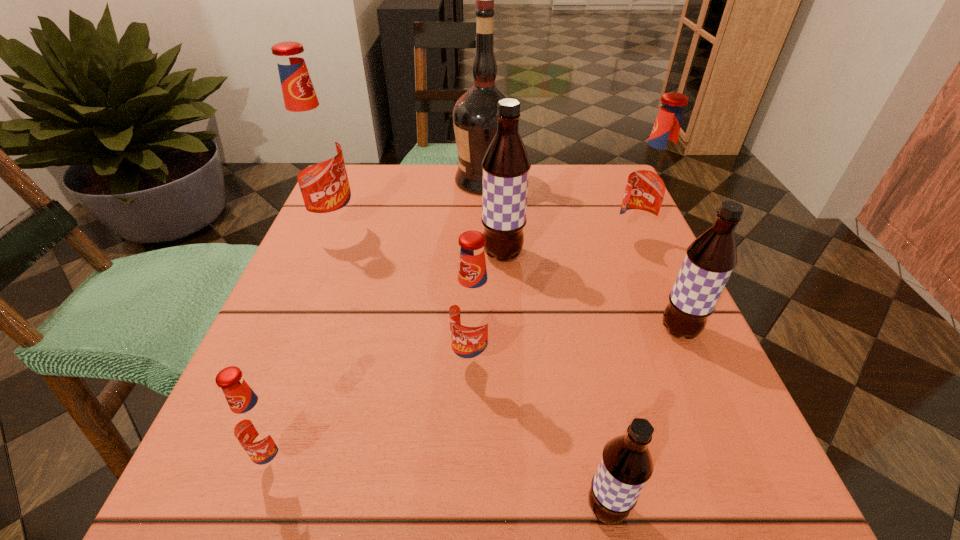
Where is `object that ranks as the sixth closest to the second biggest red root beer`? The width and height of the screenshot is (960, 540). object that ranks as the sixth closest to the second biggest red root beer is located at coordinates (314, 153).

Select which root beer is the second closest to the biggest red root beer. Please provide its 2D coordinates. Your answer should be formatted as a tuple, i.e. [(x, y)], where the tuple contains the x and y coordinates of a point satisfying the conditions above.

[(473, 309)]

The image size is (960, 540). Find the location of `root beer that is the closest to the farthest object`. root beer that is the closest to the farthest object is located at coordinates (506, 165).

Identify which red root beer is the nearest to the second biggest brown root beer. Please provide its 2D coordinates. Your answer should be formatted as a tuple, i.e. [(x, y)], where the tuple contains the x and y coordinates of a point satisfying the conditions above.

[(651, 182)]

Select which red root beer appears as the third closest to the tallest root beer. Please provide its 2D coordinates. Your answer should be formatted as a tuple, i.e. [(x, y)], where the tuple contains the x and y coordinates of a point satisfying the conditions above.

[(651, 182)]

Locate which brown root beer ranks third in proximity to the nearest red root beer. Please provide its 2D coordinates. Your answer should be formatted as a tuple, i.e. [(x, y)], where the tuple contains the x and y coordinates of a point satisfying the conditions above.

[(710, 259)]

The height and width of the screenshot is (540, 960). In order to click on the third closest brown root beer to the third smallest red root beer in this screenshot , I will do `click(626, 464)`.

Identify the location of free space in the image that satisfies the following two spatial constraints: 1. on the surface of the liquor; 2. on the back side of the rightmost red root beer. The height and width of the screenshot is (540, 960). (485, 245).

At what (x,y) coordinates should I click in order to perform the action: click on free space that satisfies the following two spatial constraints: 1. on the back side of the nearest root beer; 2. on the left side of the rightmost brown root beer. Please return your answer as a coordinate pair (x, y). Looking at the image, I should click on (570, 330).

Where is `vacant space that satisfies the following two spatial constraints: 1. on the surface of the rightmost red root beer; 2. on the right side of the farthest object`? This screenshot has height=540, width=960. vacant space that satisfies the following two spatial constraints: 1. on the surface of the rightmost red root beer; 2. on the right side of the farthest object is located at coordinates (485, 245).